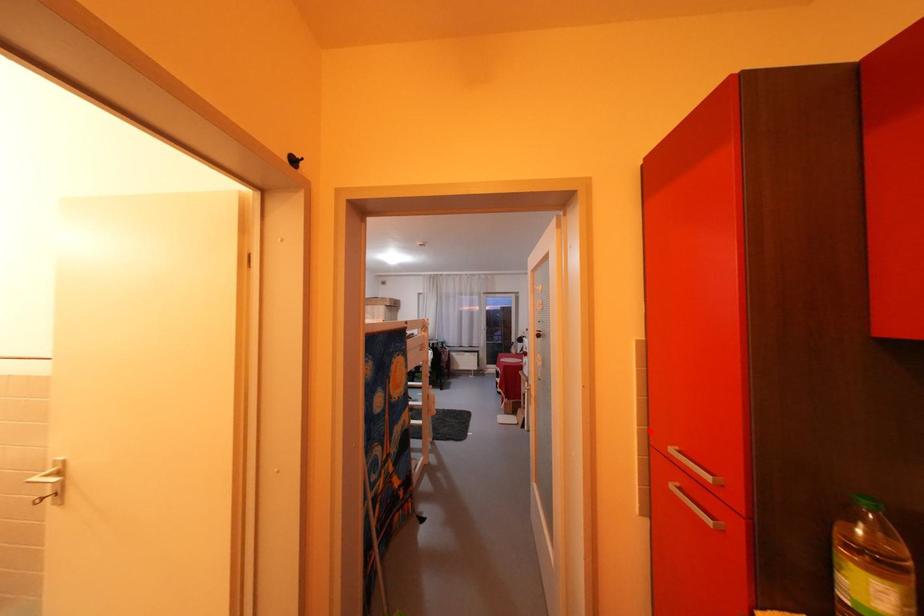
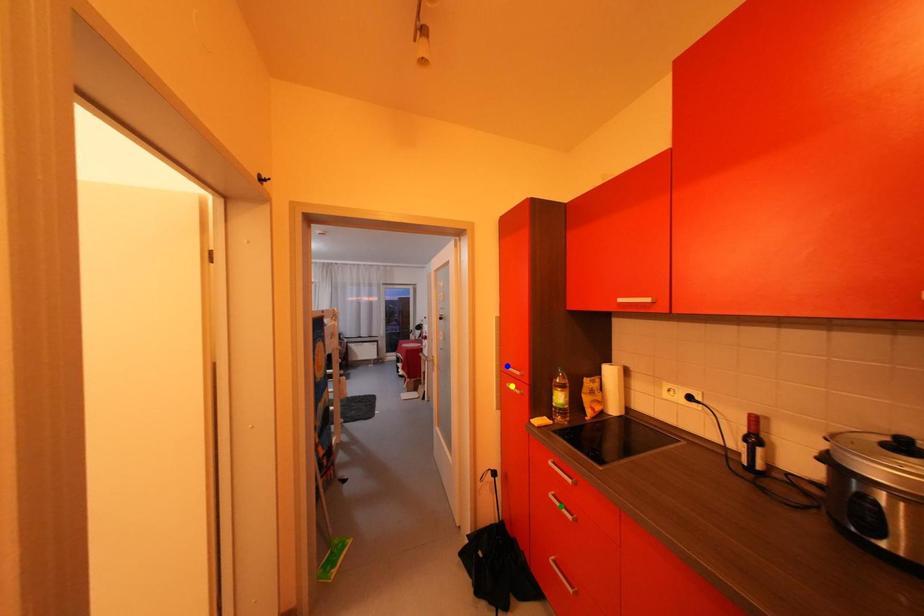
Question: I am providing you with two images of the same scene from different viewpoints. A red point is marked on the first image. You are given multiple points on the second image. Which point in image 2 represents the same 3d spot as the red point in image 1?

Choices:
 (A) blue point
 (B) green point
 (C) yellow point

Answer: (A)